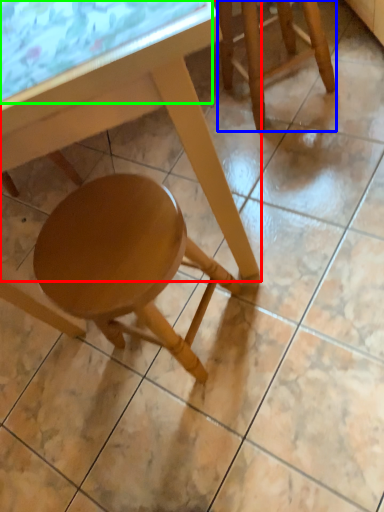
Question: Which is farther away from table (highlighted by a red box)? stool (highlighted by a blue box) or glass table (highlighted by a green box)?

Choices:
 (A) stool
 (B) glass table

Answer: (A)